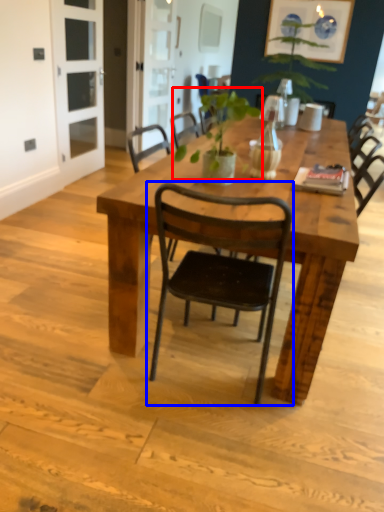
Question: Which point is closer to the camera, plant (highlighted by a red box) or chair (highlighted by a blue box)?

Choices:
 (A) plant
 (B) chair

Answer: (B)